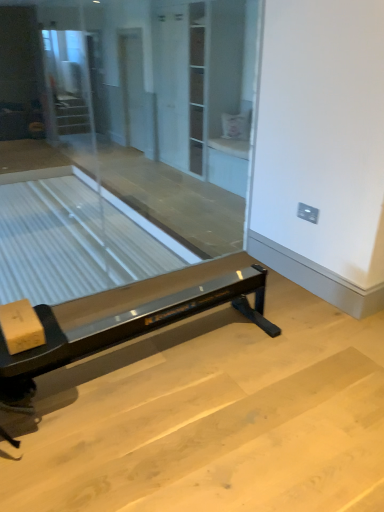
I want to click on transparent glass screen door at center, so click(x=133, y=88).

I want to click on transparent glass screen door at center, so click(x=133, y=88).

From the image's perspective, does transparent glass screen door at center appear higher than clear glass table at left?

Yes, from the image's perspective, transparent glass screen door at center is over clear glass table at left.

From a real-world perspective, is transparent glass screen door at center on top of clear glass table at left?

Correct, in the physical world, transparent glass screen door at center is higher than clear glass table at left.

Considering the sizes of objects transparent glass screen door at center and clear glass table at left in the image provided, who is thinner, transparent glass screen door at center or clear glass table at left?

transparent glass screen door at center.

Which point is more distant from viewer, [132,119] or [116,271]?

Point [132,119]

Considering the relative sizes of clear glass table at left and transparent glass screen door at center in the image provided, is clear glass table at left thinner than transparent glass screen door at center?

No.

From the image's perspective, is clear glass table at left positioned above or below transparent glass screen door at center?

Clearly, from the image's perspective, clear glass table at left is below transparent glass screen door at center.

Would you consider black glossy rowing machine at center to be distant from clear glass table at left?

That's right, there is a large distance between black glossy rowing machine at center and clear glass table at left.

The height and width of the screenshot is (512, 384). What are the coordinates of `furniture located in front of the clear glass table at left` in the screenshot? It's located at (122, 331).

Is the depth of black glossy rowing machine at center less than that of clear glass table at left?

Yes, it is in front of clear glass table at left.

Between black glossy rowing machine at center and clear glass table at left, which one has less height?

With less height is black glossy rowing machine at center.

Image resolution: width=384 pixels, height=512 pixels. I want to click on furniture above the clear glass table at left (from a real-world perspective), so click(x=122, y=331).

Is black glossy rowing machine at center located within clear glass table at left?

Actually, black glossy rowing machine at center is outside clear glass table at left.

Which point is more forward, [99,204] or [25,392]?

The point [25,392] is in front.

From a real-world perspective, who is located higher, clear glass table at left or black glossy rowing machine at center?

black glossy rowing machine at center, from a real-world perspective.

Is transparent glass screen door at center taller than black glossy rowing machine at center?

Indeed, transparent glass screen door at center has a greater height compared to black glossy rowing machine at center.

The image size is (384, 512). Find the location of `furniture beneath the transparent glass screen door at center (from a real-world perspective)`. furniture beneath the transparent glass screen door at center (from a real-world perspective) is located at coordinates click(x=122, y=331).

Is transparent glass screen door at center situated inside black glossy rowing machine at center or outside?

transparent glass screen door at center is not inside black glossy rowing machine at center, it's outside.

How far apart are transparent glass screen door at center and black glossy rowing machine at center?

transparent glass screen door at center is 5.23 meters away from black glossy rowing machine at center.

Would you say black glossy rowing machine at center is a long distance from transparent glass screen door at center?

black glossy rowing machine at center is positioned a significant distance from transparent glass screen door at center.

Is black glossy rowing machine at center positioned beyond the bounds of transparent glass screen door at center?

Absolutely, black glossy rowing machine at center is external to transparent glass screen door at center.

Which is behind, point (262, 297) or point (136, 84)?

The point (136, 84) is behind.

Does black glossy rowing machine at center have a lesser height compared to transparent glass screen door at center?

Correct, black glossy rowing machine at center is not as tall as transparent glass screen door at center.

Locate an element on the screen. table below the transparent glass screen door at center (from a real-world perspective) is located at coordinates (70, 243).

Locate an element on the screen. Image resolution: width=384 pixels, height=512 pixels. screen door to the right of clear glass table at left is located at coordinates (133, 88).

Considering their positions, is transparent glass screen door at center positioned further to black glossy rowing machine at center than clear glass table at left?

transparent glass screen door at center lies further to black glossy rowing machine at center than the other object.

Looking at the image, which one is located closer to clear glass table at left, transparent glass screen door at center or black glossy rowing machine at center?

transparent glass screen door at center.

Estimate the real-world distances between objects in this image. Which object is further from clear glass table at left, black glossy rowing machine at center or transparent glass screen door at center?

black glossy rowing machine at center is further to clear glass table at left.

From the picture: When comparing their distances from transparent glass screen door at center, does clear glass table at left or black glossy rowing machine at center seem further?

The object further to transparent glass screen door at center is black glossy rowing machine at center.

Estimate the real-world distances between objects in this image. Which object is closer to transparent glass screen door at center, black glossy rowing machine at center or clear glass table at left?

Based on the image, clear glass table at left appears to be nearer to transparent glass screen door at center.

Based on their spatial positions, is clear glass table at left or transparent glass screen door at center closer to black glossy rowing machine at center?

clear glass table at left is closer to black glossy rowing machine at center.

This screenshot has width=384, height=512. What are the coordinates of `table positioned between black glossy rowing machine at center and transparent glass screen door at center from near to far` in the screenshot? It's located at (70, 243).